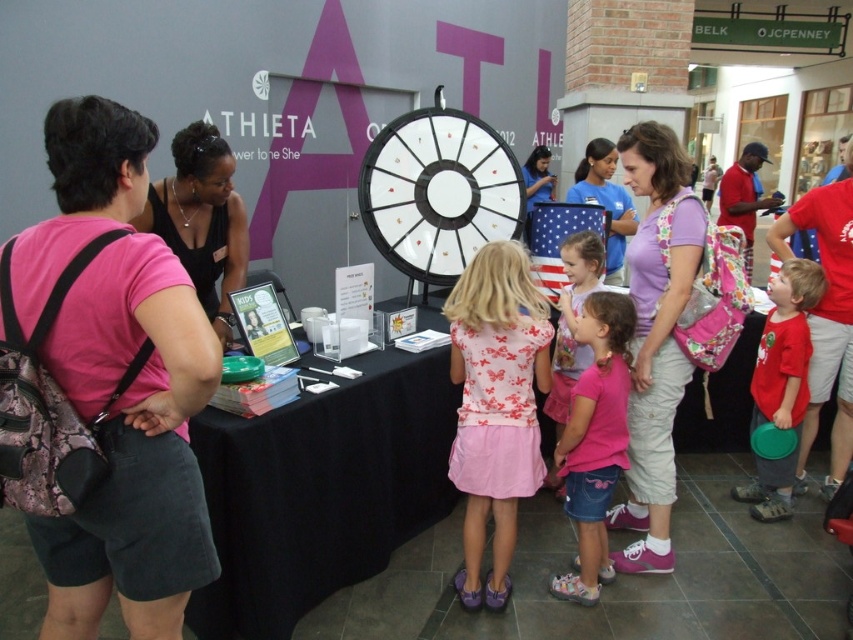
You are a participant at the event and want to find the blue denim shirt at center. Where would you look relative to the purple floral backpack at center?

The blue denim shirt at center is above the purple floral backpack at center, so you should look upward from the purple floral backpack at center to find it.